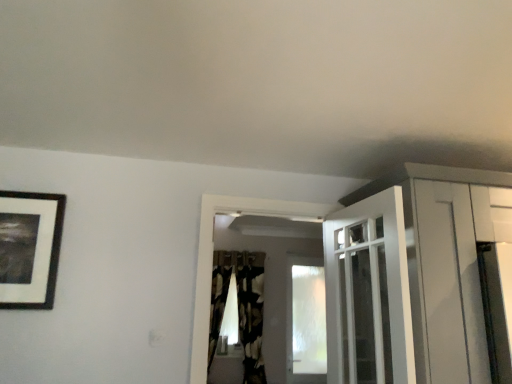
Question: Considering the positions of black textured curtain at center and white glossy door at upper center in the image, is black textured curtain at center taller or shorter than white glossy door at upper center?

Choices:
 (A) tall
 (B) short

Answer: (A)

Question: Is black textured curtain at center inside the boundaries of white glossy door at upper center, or outside?

Choices:
 (A) inside
 (B) outside

Answer: (B)

Question: Which of these objects is positioned closest to the black matte picture frame at upper left?

Choices:
 (A) black textured curtain at center
 (B) transparent frosted glass window at center
 (C) white glossy door at upper center

Answer: (C)

Question: Which is nearer to the black matte picture frame at upper left?

Choices:
 (A) transparent frosted glass window at center
 (B) black textured curtain at center
 (C) white glossy door at upper center

Answer: (C)